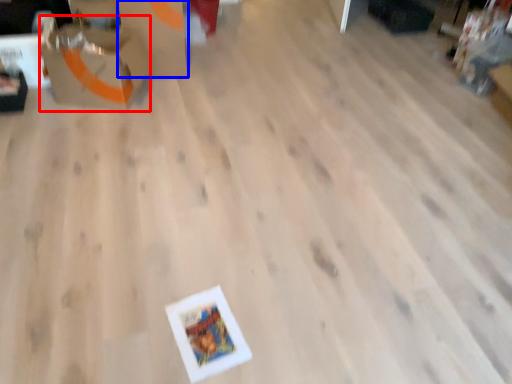
Question: Among these objects, which one is nearest to the camera, cardboard box (highlighted by a red box) or cardboard box (highlighted by a blue box)?

Choices:
 (A) cardboard box
 (B) cardboard box

Answer: (A)